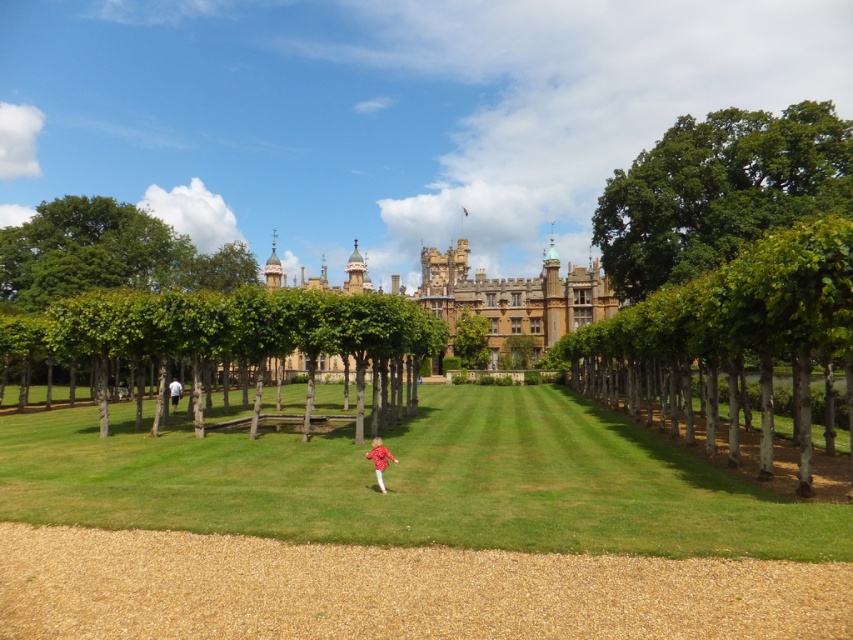
Question: Is the position of green leafy trees at center more distant than that of red matte shirt at center?

Choices:
 (A) no
 (B) yes

Answer: (B)

Question: Which point is closer to the camera?

Choices:
 (A) (851, 371)
 (B) (234, 502)

Answer: (A)

Question: Which point appears farthest from the camera in this image?

Choices:
 (A) [x=123, y=577]
 (B) [x=180, y=394]
 (C) [x=607, y=301]
 (D) [x=613, y=387]

Answer: (C)

Question: Which is farther from the red matte shirt at center?

Choices:
 (A) green leafy trees at center
 (B) golden stone palace at center
 (C) green smooth tree at right

Answer: (C)

Question: Can you confirm if green smooth tree at right is smaller than green leafy trees at center?

Choices:
 (A) yes
 (B) no

Answer: (B)

Question: Does green grass at center appear on the left side of green leafy trees at center?

Choices:
 (A) yes
 (B) no

Answer: (B)